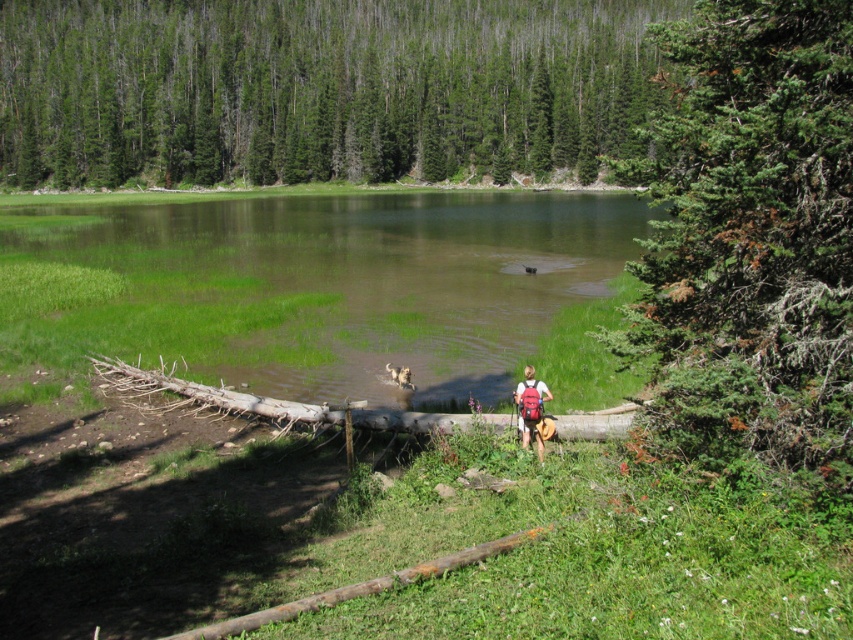
Between point (334, 228) and point (407, 376), which one is positioned in front?

Positioned in front is point (407, 376).

Is point (108, 336) farther from camera compared to point (399, 369)?

That is True.

Who is more forward, (583, 228) or (413, 387)?

Positioned in front is point (413, 387).

At what (x,y) coordinates should I click in order to perform the action: click on green grassy lake at center. Please return your answer as a coordinate pair (x, y). Looking at the image, I should click on (332, 284).

Does green textured forest at upper center appear over golden fur dog at center?

Yes.

Between point (68, 36) and point (389, 364), which one is positioned in front?

Point (389, 364) is more forward.

Locate an element on the screen. Image resolution: width=853 pixels, height=640 pixels. green textured forest at upper center is located at coordinates (317, 88).

Describe the element at coordinates (532, 408) in the screenshot. I see `matte red backpack at center` at that location.

Is matte red backpack at center wider than golden fur dog at center?

No, matte red backpack at center is not wider than golden fur dog at center.

Does point (526, 371) lie behind point (407, 381)?

No.

The image size is (853, 640). In order to click on matte red backpack at center in this screenshot , I will do `click(532, 408)`.